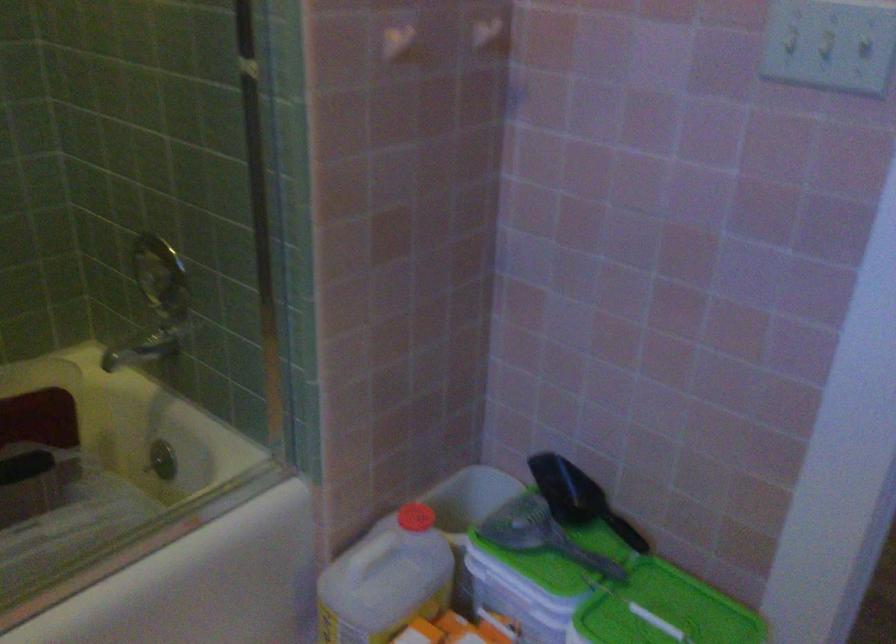
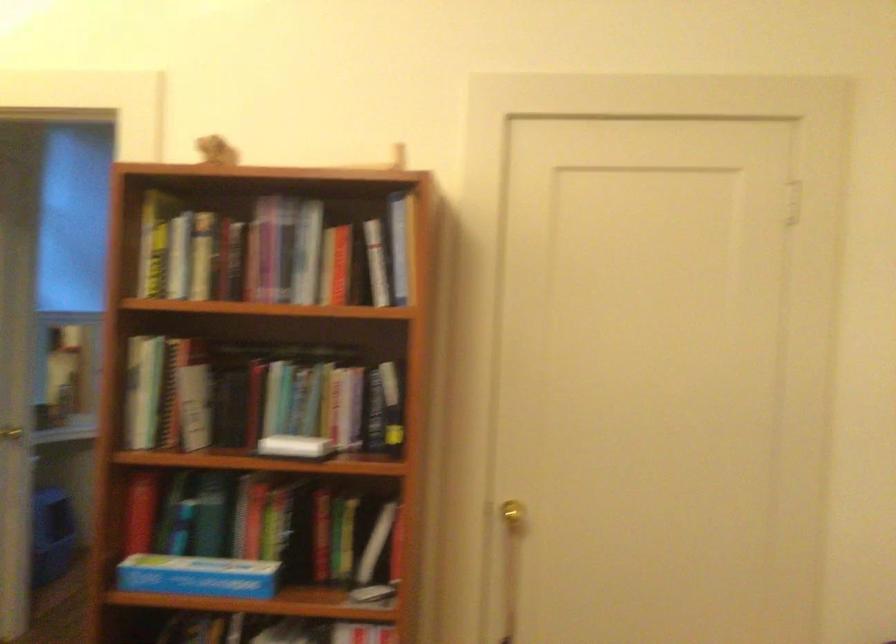
Question: I am providing you with two images of the same scene from different viewpoints. Which of the following objects are not visible in image2?

Choices:
 (A) shower faucet handle
 (B) blue cardboard box
 (C) white device handle
 (D) silver door knob

Answer: (A)